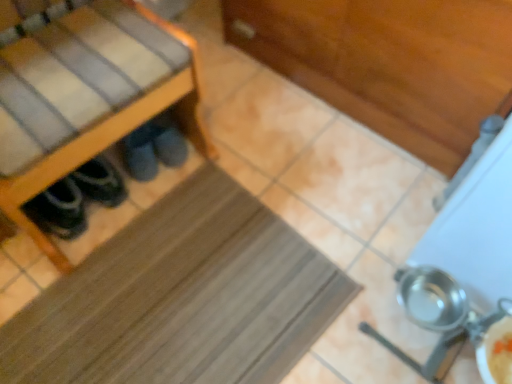
Locate an element on the screen. vacant space behind metallic silver pot at lower right is located at coordinates (373, 237).